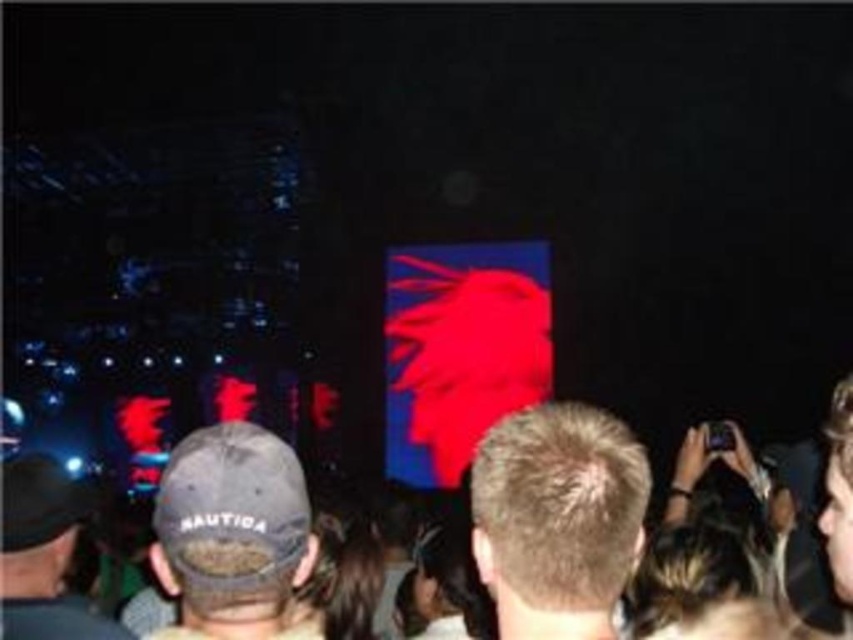
Question: Based on their relative distances, which object is nearer to the dark gray baseball cap at lower left?

Choices:
 (A) camo fabric baseball cap at lower left
 (B) blonde hair at center
 (C) black matte baseball cap at left

Answer: (C)

Question: Which point is closer to the camera?

Choices:
 (A) dark gray baseball cap at lower left
 (B) blonde hair at center
 (C) light brown leather cap at upper center
 (D) camo fabric baseball cap at lower left

Answer: (B)

Question: From the image, what is the correct spatial relationship of blonde hair at center in relation to camo fabric baseball cap at lower left?

Choices:
 (A) above
 (B) below

Answer: (B)

Question: Can you confirm if black matte baseball cap at left is thinner than light brown leather cap at upper center?

Choices:
 (A) no
 (B) yes

Answer: (A)

Question: Can you confirm if camo fabric baseball cap at lower left is thinner than black matte baseball cap at left?

Choices:
 (A) yes
 (B) no

Answer: (B)

Question: Which object appears closest to the camera in this image?

Choices:
 (A) blonde hair at center
 (B) dark gray baseball cap at lower left

Answer: (A)